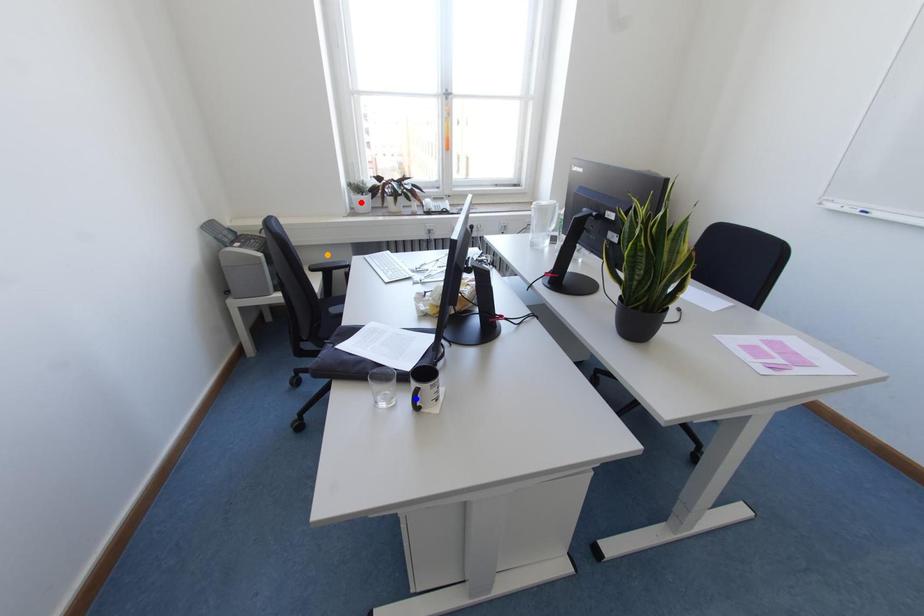
Order these from nearest to farthest:
- red point
- orange point
- blue point

red point, orange point, blue point